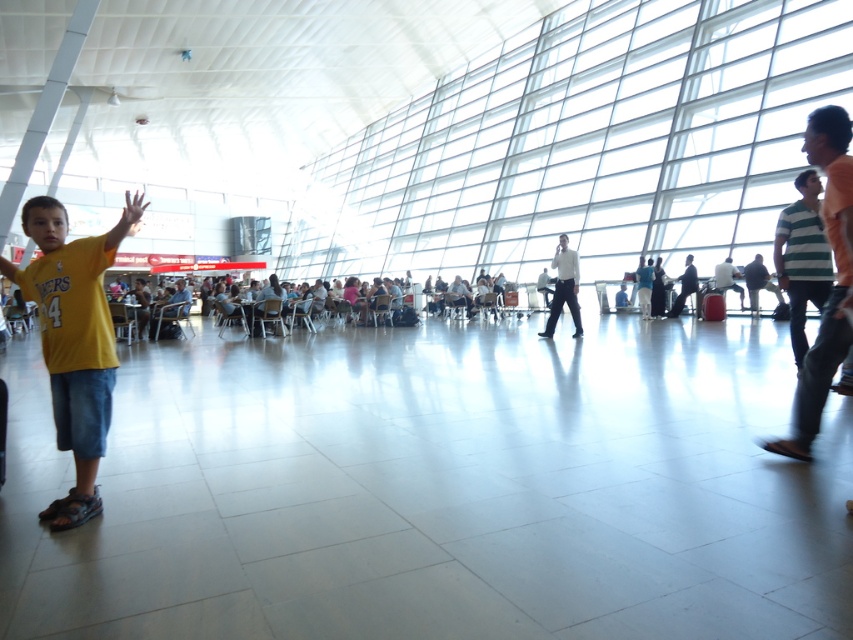
Question: Is the position of yellow matte shirt at left more distant than that of dark gray suit at center?

Choices:
 (A) no
 (B) yes

Answer: (A)

Question: Is yellow matte shirt at left above white smooth shirt at center?

Choices:
 (A) no
 (B) yes

Answer: (A)

Question: Based on their relative distances, which object is nearer to the dark gray suit at center?

Choices:
 (A) yellow matte shirt at left
 (B) white smooth shirt at center

Answer: (B)

Question: Based on their relative distances, which object is farther from the white smooth shirt at center?

Choices:
 (A) yellow matte shirt at left
 (B) dark gray suit at center

Answer: (A)

Question: Where is yellow matte shirt at left located in relation to white smooth shirt at center in the image?

Choices:
 (A) below
 (B) above

Answer: (A)

Question: Based on their relative distances, which object is farther from the white smooth shirt at center?

Choices:
 (A) dark gray suit at center
 (B) yellow matte shirt at left

Answer: (B)